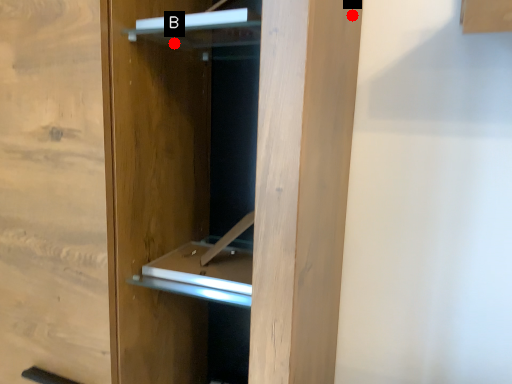
Question: Two points are circled on the image, labeled by A and B beside each circle. Among these points, which one is farthest from the camera?

Choices:
 (A) A is further
 (B) B is further

Answer: (B)